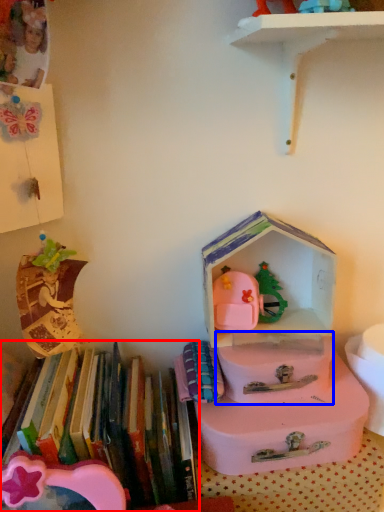
Question: Which object appears farthest to the camera in this image, book (highlighted by a red box) or box (highlighted by a blue box)?

Choices:
 (A) book
 (B) box

Answer: (B)